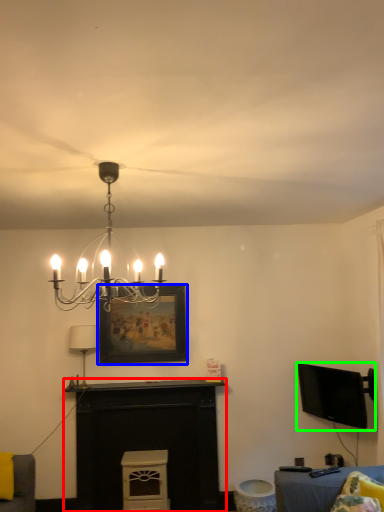
Question: Which object is positioned farthest from fireplace (highlighted by a red box)? Select from picture frame (highlighted by a blue box) and television (highlighted by a green box).

Choices:
 (A) picture frame
 (B) television

Answer: (B)